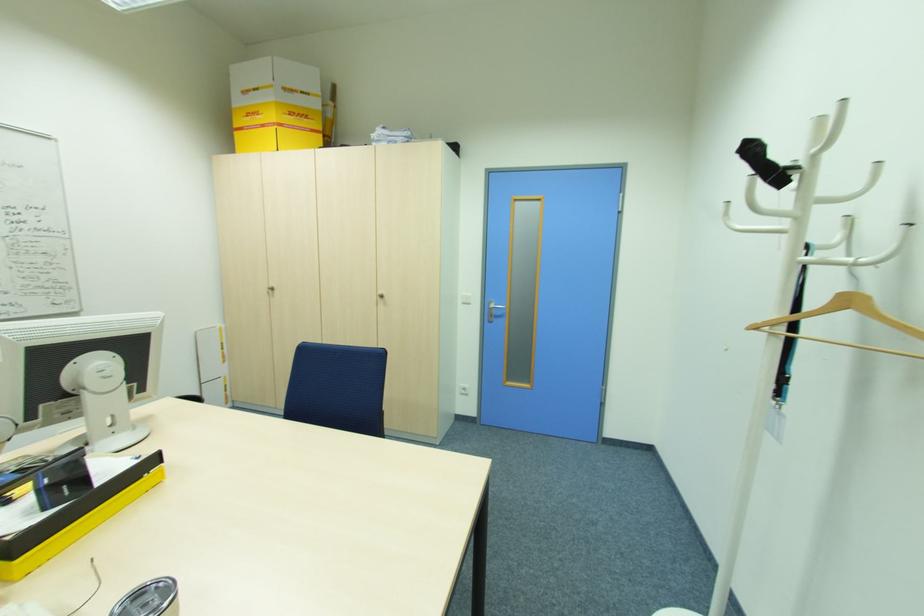
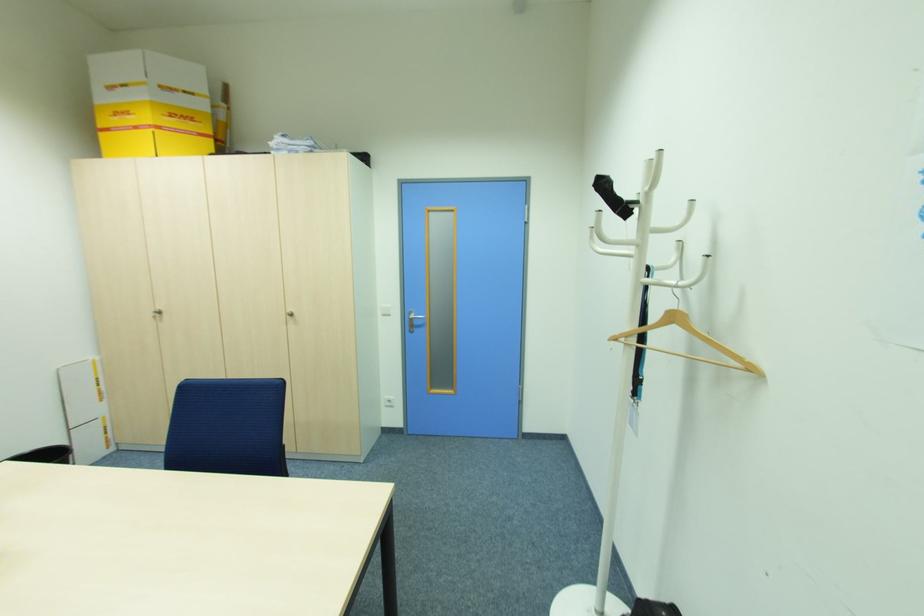
In the second image, find the point that corresponds to (x=383, y=293) in the first image.

(292, 310)